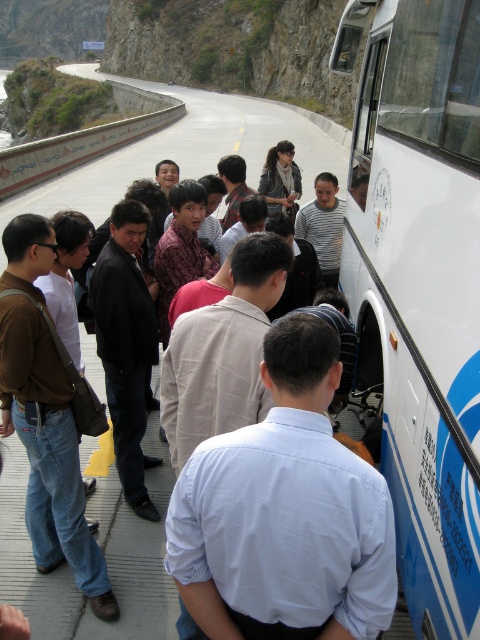
Question: In this image, where is light blue shirt at center located relative to dark gray leather jacket at center?

Choices:
 (A) right
 (B) left

Answer: (B)

Question: Where is matte white bus at right located in relation to black smooth suit at center in the image?

Choices:
 (A) right
 (B) left

Answer: (B)

Question: Which point appears farthest from the camera in this image?

Choices:
 (A) (131, 541)
 (B) (119, 426)
 (C) (465, 420)

Answer: (B)

Question: Does white matte bus at right lie behind light blue shirt at center?

Choices:
 (A) no
 (B) yes

Answer: (B)

Question: Which of the following is the farthest from the observer?

Choices:
 (A) light blue shirt at center
 (B) matte white bus at right
 (C) brown denim jeans at left
 (D) white matte bus at right

Answer: (B)

Question: Which point is farther to the camera?

Choices:
 (A) brown denim jeans at left
 (B) matte white bus at right
 (C) white matte bus at right
 (D) light blue shirt at center

Answer: (B)